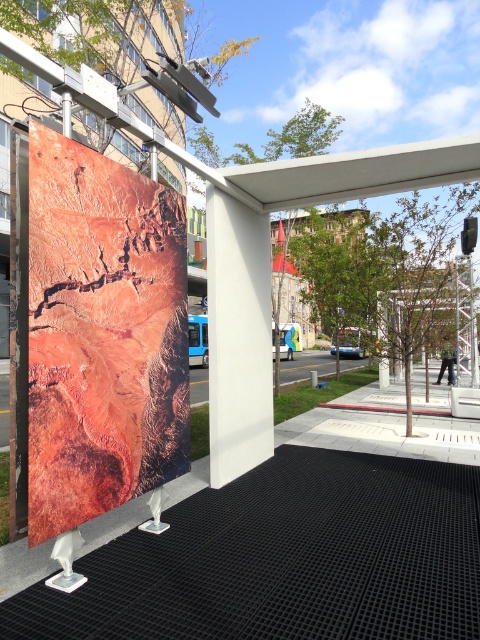
Question: Which point is farther from the camera taking this photo?

Choices:
 (A) (244, 387)
 (B) (56, 433)

Answer: (A)

Question: Can you confirm if rustic canvas poster at center is positioned below white matte pillar at center?

Choices:
 (A) yes
 (B) no

Answer: (B)

Question: Which point is farther to the camera?

Choices:
 (A) white matte pillar at center
 (B) rustic canvas poster at center

Answer: (A)

Question: Among these objects, which one is nearest to the camera?

Choices:
 (A) white matte pillar at center
 (B) rustic canvas poster at center

Answer: (B)

Question: Can you confirm if rustic canvas poster at center is positioned to the left of white matte pillar at center?

Choices:
 (A) yes
 (B) no

Answer: (A)

Question: Considering the relative positions of rustic canvas poster at center and white matte pillar at center in the image provided, where is rustic canvas poster at center located with respect to white matte pillar at center?

Choices:
 (A) below
 (B) above

Answer: (B)